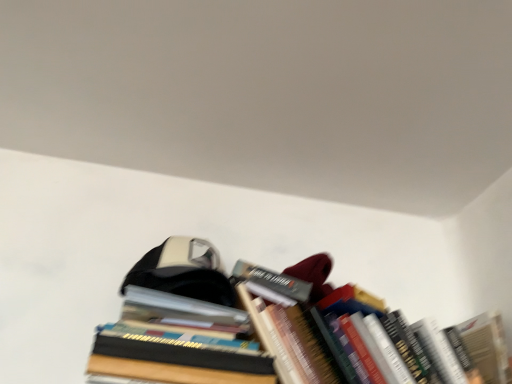
What do you see at coordinates (218, 339) in the screenshot? The height and width of the screenshot is (384, 512). I see `hardcover books at upper right, positioned as the first book in right-to-left order` at bounding box center [218, 339].

At what (x,y) coordinates should I click in order to perform the action: click on hardcover books at upper right, the second book from the left. Please return your answer as a coordinate pair (x, y). Image resolution: width=512 pixels, height=384 pixels. Looking at the image, I should click on (218, 339).

The height and width of the screenshot is (384, 512). I want to click on hardcover books at center, positioned as the first book in left-to-right order, so click(x=175, y=359).

Describe the element at coordinates (175, 359) in the screenshot. This screenshot has width=512, height=384. I see `hardcover books at center, positioned as the first book in left-to-right order` at that location.

Measure the distance between hardcover books at center, positioned as the first book in left-to-right order, and camera.

The depth of hardcover books at center, positioned as the first book in left-to-right order, is 68.04 centimeters.

The height and width of the screenshot is (384, 512). In order to click on hardcover books at upper right, positioned as the first book in right-to-left order in this screenshot , I will do `click(218, 339)`.

Consider the image. Considering the positions of objects hardcover books at center, placed as the 2th book when sorted from right to left, and hardcover books at upper right, positioned as the first book in right-to-left order, in the image provided, who is more to the left, hardcover books at center, placed as the 2th book when sorted from right to left, or hardcover books at upper right, positioned as the first book in right-to-left order,?

hardcover books at center, placed as the 2th book when sorted from right to left.

Which object is closer to the camera taking this photo, hardcover books at center, positioned as the first book in left-to-right order, or hardcover books at upper right, the second book from the left?

hardcover books at center, positioned as the first book in left-to-right order, is more forward.

Is point (206, 377) positioned in front of point (194, 317)?

Yes, it is.

From the image's perspective, does hardcover books at center, placed as the 2th book when sorted from right to left, appear lower than hardcover books at upper right, positioned as the first book in right-to-left order?

No, from the image's perspective, hardcover books at center, placed as the 2th book when sorted from right to left, is not below hardcover books at upper right, positioned as the first book in right-to-left order.

From a real-world perspective, who is located higher, hardcover books at center, placed as the 2th book when sorted from right to left, or hardcover books at upper right, positioned as the first book in right-to-left order?

hardcover books at upper right, positioned as the first book in right-to-left order.

Which of these two, hardcover books at center, placed as the 2th book when sorted from right to left, or hardcover books at upper right, positioned as the first book in right-to-left order, is wider?

Wider between the two is hardcover books at upper right, positioned as the first book in right-to-left order.

Considering the sizes of hardcover books at center, placed as the 2th book when sorted from right to left, and hardcover books at upper right, positioned as the first book in right-to-left order, in the image, is hardcover books at center, placed as the 2th book when sorted from right to left, taller or shorter than hardcover books at upper right, positioned as the first book in right-to-left order,?

In the image, hardcover books at center, placed as the 2th book when sorted from right to left, appears to be shorter than hardcover books at upper right, positioned as the first book in right-to-left order.

Between hardcover books at center, placed as the 2th book when sorted from right to left, and hardcover books at upper right, positioned as the first book in right-to-left order, which one has larger size?

Bigger between the two is hardcover books at upper right, positioned as the first book in right-to-left order.

Do you think hardcover books at center, positioned as the first book in left-to-right order, is within hardcover books at upper right, the second book from the left, or outside of it?

hardcover books at center, positioned as the first book in left-to-right order, is located beyond the bounds of hardcover books at upper right, the second book from the left.

Is hardcover books at center, positioned as the first book in left-to-right order, in contact with hardcover books at upper right, positioned as the first book in right-to-left order?

No.

Is hardcover books at center, placed as the 2th book when sorted from right to left, facing away from hardcover books at upper right, the second book from the left?

No, hardcover books at center, placed as the 2th book when sorted from right to left,'s orientation is not away from hardcover books at upper right, the second book from the left.

What's the angular difference between hardcover books at center, positioned as the first book in left-to-right order, and hardcover books at upper right, the second book from the left,'s facing directions?

They differ by 0.000862 degrees in their facing directions.

Measure the distance between hardcover books at center, placed as the 2th book when sorted from right to left, and hardcover books at upper right, positioned as the first book in right-to-left order.

hardcover books at center, placed as the 2th book when sorted from right to left, is 4.45 inches from hardcover books at upper right, positioned as the first book in right-to-left order.

In order to click on book behind the hardcover books at center, positioned as the first book in left-to-right order in this screenshot , I will do `click(218, 339)`.

In the scene shown: Is hardcover books at upper right, positioned as the first book in right-to-left order, to the left or to the right of hardcover books at center, positioned as the first book in left-to-right order, in the image?

From the image, it's evident that hardcover books at upper right, positioned as the first book in right-to-left order, is to the right of hardcover books at center, positioned as the first book in left-to-right order.

Between hardcover books at upper right, positioned as the first book in right-to-left order, and hardcover books at center, positioned as the first book in left-to-right order, which one is positioned in front?

hardcover books at center, positioned as the first book in left-to-right order, is closer to the camera.

Is point (145, 376) positioned after point (143, 349)?

That is False.

From the image's perspective, is hardcover books at upper right, the second book from the left, beneath hardcover books at center, positioned as the first book in left-to-right order?

Correct, hardcover books at upper right, the second book from the left, appears lower than hardcover books at center, positioned as the first book in left-to-right order, in the image.

From a real-world perspective, is hardcover books at upper right, positioned as the first book in right-to-left order, over hardcover books at center, positioned as the first book in left-to-right order?

Yes, from a real-world perspective, hardcover books at upper right, positioned as the first book in right-to-left order, is over hardcover books at center, positioned as the first book in left-to-right order

Can you confirm if hardcover books at upper right, positioned as the first book in right-to-left order, is thinner than hardcover books at center, placed as the 2th book when sorted from right to left?

Incorrect, the width of hardcover books at upper right, positioned as the first book in right-to-left order, is not less than that of hardcover books at center, placed as the 2th book when sorted from right to left.

Between hardcover books at upper right, positioned as the first book in right-to-left order, and hardcover books at center, placed as the 2th book when sorted from right to left, which one has more height?

With more height is hardcover books at upper right, positioned as the first book in right-to-left order.

Can you confirm if hardcover books at upper right, positioned as the first book in right-to-left order, is smaller than hardcover books at center, positioned as the first book in left-to-right order?

Incorrect, hardcover books at upper right, positioned as the first book in right-to-left order, is not smaller in size than hardcover books at center, positioned as the first book in left-to-right order.

Is hardcover books at upper right, positioned as the first book in right-to-left order, surrounding hardcover books at center, positioned as the first book in left-to-right order?

That's incorrect, hardcover books at center, positioned as the first book in left-to-right order, is not inside hardcover books at upper right, positioned as the first book in right-to-left order.

Is hardcover books at upper right, positioned as the first book in right-to-left order, touching hardcover books at center, placed as the 2th book when sorted from right to left?

hardcover books at upper right, positioned as the first book in right-to-left order, and hardcover books at center, placed as the 2th book when sorted from right to left, are clearly separated.

Is hardcover books at upper right, the second book from the left, aimed at hardcover books at center, placed as the 2th book when sorted from right to left?

No.

How distant is hardcover books at upper right, positioned as the first book in right-to-left order, from hardcover books at center, positioned as the first book in left-to-right order?

The distance of hardcover books at upper right, positioned as the first book in right-to-left order, from hardcover books at center, positioned as the first book in left-to-right order, is 11.31 centimeters.

Identify the location of book above the hardcover books at center, placed as the 2th book when sorted from right to left (from a real-world perspective). The image size is (512, 384). (218, 339).

Image resolution: width=512 pixels, height=384 pixels. In the image, there is a hardcover books at upper right, the second book from the left. Find the location of `book below it (from a real-world perspective)`. book below it (from a real-world perspective) is located at coordinates (175, 359).

Find the location of a particular element. This screenshot has height=384, width=512. book below the hardcover books at center, positioned as the first book in left-to-right order (from the image's perspective) is located at coordinates (218, 339).